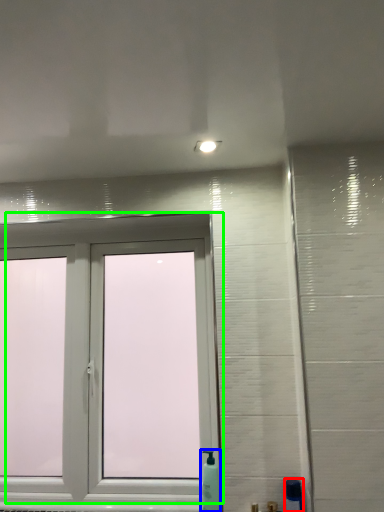
Question: Estimate the real-world distances between objects in this image. Which object is closer to soap dispenser (highlighted by a red box), soap dispenser (highlighted by a blue box) or window (highlighted by a green box)?

Choices:
 (A) soap dispenser
 (B) window

Answer: (A)